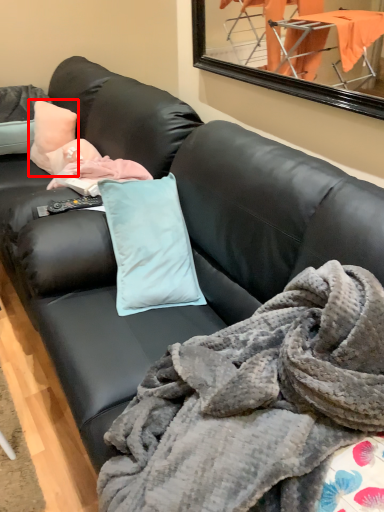
Question: From the image's perspective, where is pillow (annotated by the red box) located in relation to blanket in the image?

Choices:
 (A) above
 (B) below

Answer: (A)